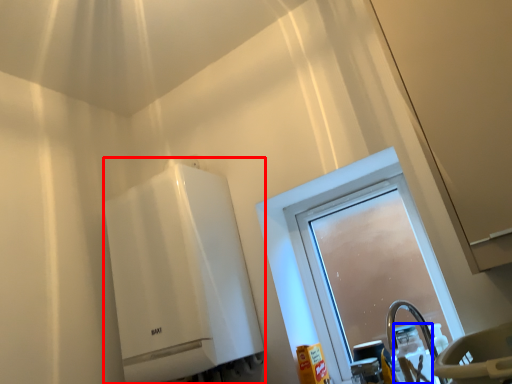
Question: Which point is further to the camera, water heater (highlighted by a red box) or bottle (highlighted by a blue box)?

Choices:
 (A) water heater
 (B) bottle

Answer: (A)